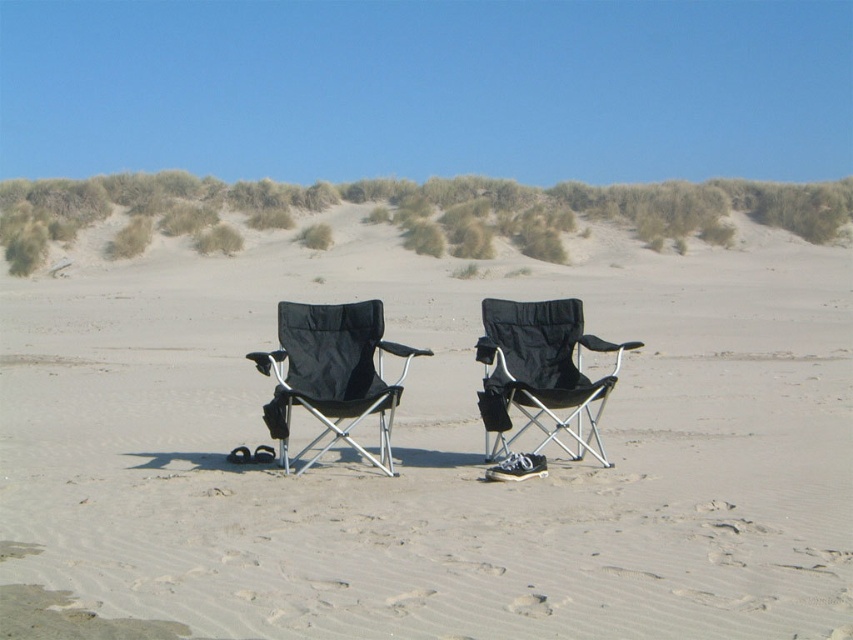
Between black fabric chairs at center and black fabric chair at center, which one is positioned higher?

black fabric chairs at center is higher up.

Does black fabric chairs at center appear under black fabric chair at center?

Incorrect, black fabric chairs at center is not positioned below black fabric chair at center.

Locate an element on the screen. Image resolution: width=853 pixels, height=640 pixels. black fabric chairs at center is located at coordinates (422, 420).

Can you confirm if black fabric chairs at center is taller than green grassy dune at upper center?

In fact, black fabric chairs at center may be shorter than green grassy dune at upper center.

Does black fabric chairs at center appear on the right side of green grassy dune at upper center?

Incorrect, black fabric chairs at center is not on the right side of green grassy dune at upper center.

This screenshot has height=640, width=853. What are the coordinates of `black fabric chairs at center` in the screenshot? It's located at (422, 420).

From the picture: Can you confirm if black fabric chairs at center is smaller than black fabric folding chair at center?

No.

Which of these two, black fabric chairs at center or black fabric folding chair at center, stands shorter?

black fabric folding chair at center

Which is in front, point (633, 244) or point (372, 330)?

Point (372, 330) is more forward.

At what (x,y) coordinates should I click in order to perform the action: click on black fabric chairs at center. Please return your answer as a coordinate pair (x, y). Looking at the image, I should click on click(x=422, y=420).